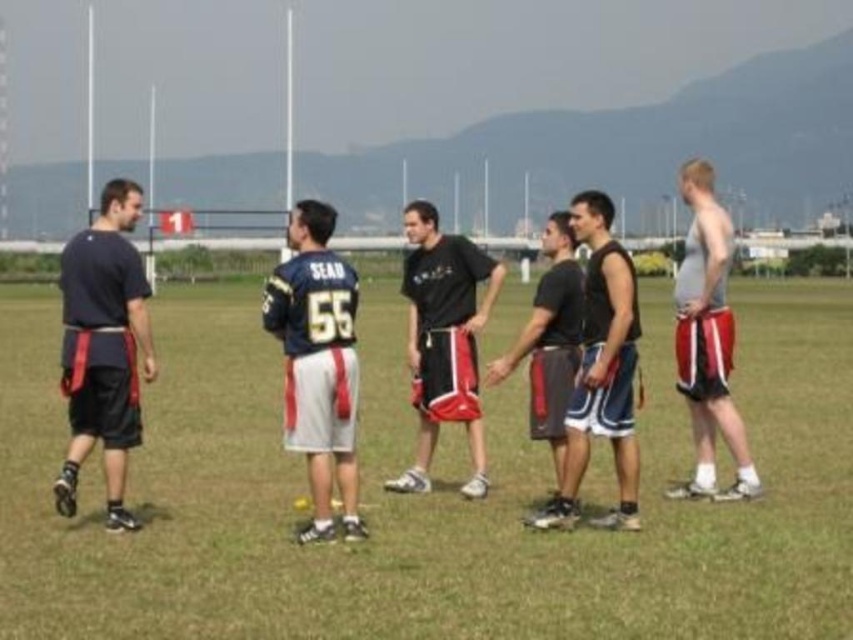
You are a photographer positioned at the center of the field. You want to capture a photo that includes both the point at coordinates point (x=415, y=481) and point (x=631, y=525). Which point should you focus on first to ensure both are in the frame?

You should focus on point (x=415, y=481) first because it is closer to you than point (x=631, y=525), ensuring both points are within the camera frame.

What are the coordinates of the green grass football field at center?

The coordinates of the green grass football field at center are point (424, 493).

You are a photographer trying to capture a shot of the green grass football field at center and the dark gray fabric shorts at center. Based on their positions, which object should appear higher in your photo?

The dark gray fabric shorts at center should appear higher in the photo since the green grass football field at center is located below it.